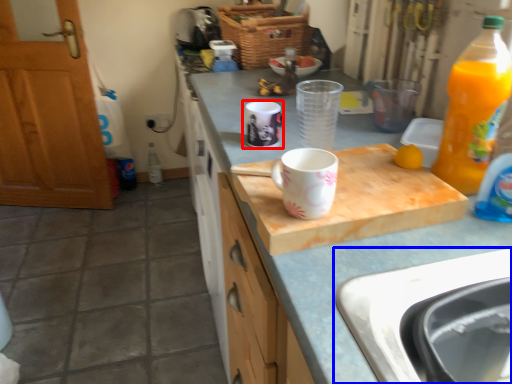
Question: Which object appears farthest to the camera in this image, coffee cup (highlighted by a red box) or sink (highlighted by a blue box)?

Choices:
 (A) coffee cup
 (B) sink

Answer: (A)